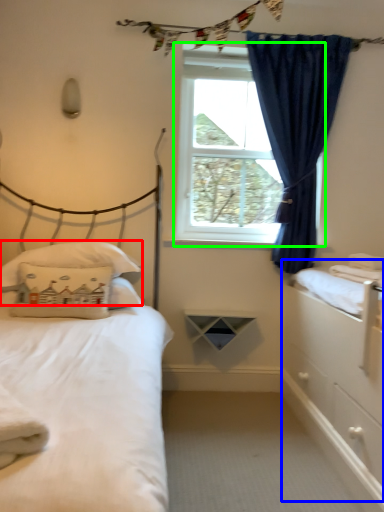
Question: Based on their relative distances, which object is farther from pillow (highlighted by a red box)? Choose from dresser (highlighted by a blue box) and window screen (highlighted by a green box).

Choices:
 (A) dresser
 (B) window screen

Answer: (A)